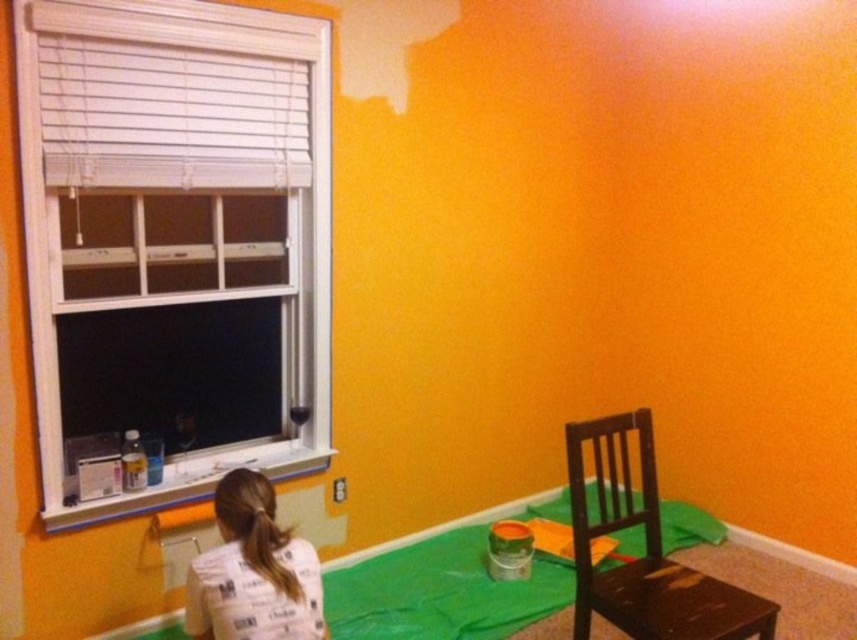
Does white plastic window at left have a smaller size compared to white paper bag at lower center?

No, white plastic window at left is not smaller than white paper bag at lower center.

What do you see at coordinates (177, 198) in the screenshot? Image resolution: width=857 pixels, height=640 pixels. I see `white plastic window at left` at bounding box center [177, 198].

Is point (166, 470) in front of point (250, 620)?

No.

Where is `white plastic window at left`? white plastic window at left is located at coordinates (177, 198).

Which is above, white plastic window at left or dark brown wooden chair at lower right?

Positioned higher is white plastic window at left.

Can you confirm if white plastic window at left is positioned below dark brown wooden chair at lower right?

No.

The image size is (857, 640). What are the coordinates of `white plastic window at left` in the screenshot? It's located at (177, 198).

I want to click on white plastic window at left, so click(x=177, y=198).

Where is `dark brown wooden chair at lower right`? This screenshot has height=640, width=857. dark brown wooden chair at lower right is located at coordinates (645, 550).

Between dark brown wooden chair at lower right and white paper bag at lower center, which one appears on the right side from the viewer's perspective?

dark brown wooden chair at lower right

Does point (652, 588) lie behind point (261, 502)?

Yes.

The width and height of the screenshot is (857, 640). Find the location of `dark brown wooden chair at lower right`. dark brown wooden chair at lower right is located at coordinates (645, 550).